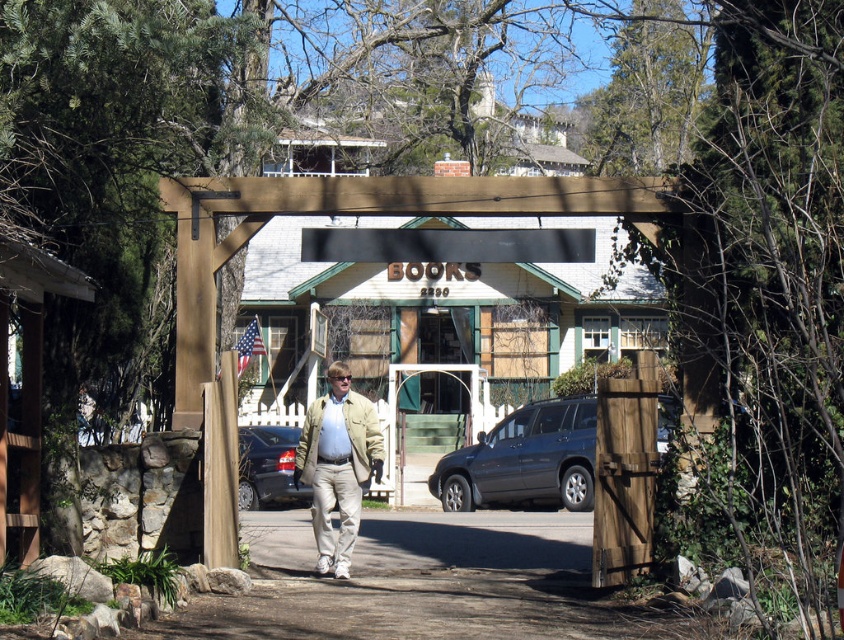
Can you confirm if matte dark blue suv at center is smaller than shiny dark blue sedan at center?

No, matte dark blue suv at center is not smaller than shiny dark blue sedan at center.

Is point (485, 506) positioned in front of point (284, 456)?

Yes, it is in front of point (284, 456).

Locate an element on the screen. The image size is (844, 640). matte dark blue suv at center is located at coordinates (523, 460).

Is tan fabric jacket at center closer to the viewer compared to shiny dark blue sedan at center?

Yes, it is in front of shiny dark blue sedan at center.

Who is lower down, tan fabric jacket at center or shiny dark blue sedan at center?

shiny dark blue sedan at center

Does point (374, 436) come in front of point (273, 456)?

Yes, point (374, 436) is in front of point (273, 456).

The image size is (844, 640). I want to click on tan fabric jacket at center, so click(x=337, y=465).

This screenshot has height=640, width=844. Describe the element at coordinates (523, 460) in the screenshot. I see `matte dark blue suv at center` at that location.

Does matte dark blue suv at center have a greater height compared to tan fabric jacket at center?

Correct, matte dark blue suv at center is much taller as tan fabric jacket at center.

Is point (452, 493) farther from camera compared to point (318, 465)?

Yes, it is.

Identify the location of matte dark blue suv at center. This screenshot has height=640, width=844. (523, 460).